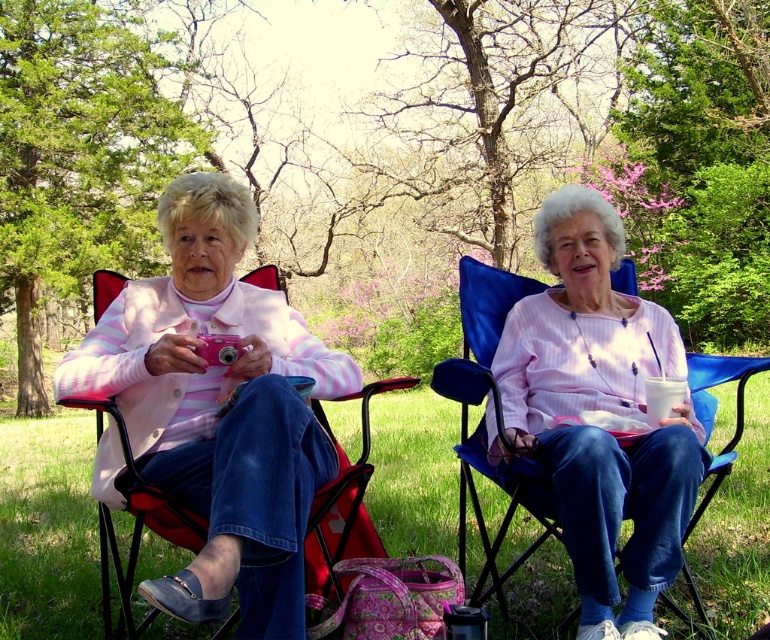
Based on the photo, you are a photographer trying to capture the scene with two elderly women. You notice the pink matte camera at left and the pink striped shirt at center. Which object is positioned lower from the ground?

The pink matte camera at left is located below pink striped shirt at center, so it is positioned lower from the ground.

You are a photographer trying to decide where to place a new tripod in the scene. The tripod needs to be taller than both the pink matte camera at left and the pink striped shirt at center. Can you place the tripod in a position where it is taller than both objects?

The pink matte camera at left has a lesser height compared to the pink striped shirt at center. Therefore, the tripod must be taller than the pink striped shirt at center to satisfy both conditions. If the tripod meets this requirement, it can be placed anywhere in the scene as long as it is positioned appropriately.